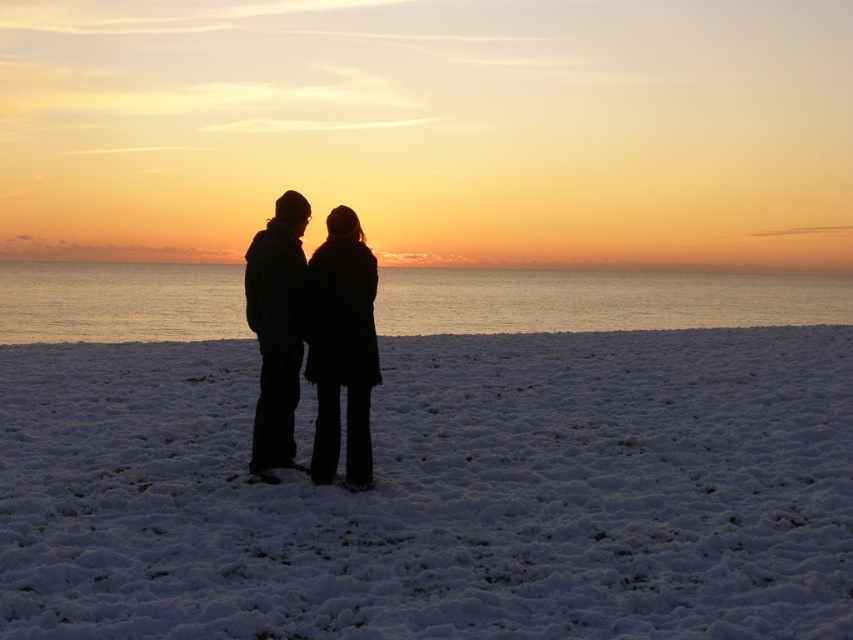
You are a photographer trying to capture both the black fuzzy coat at center and the black matte coat at center in your shot. Which coat should you focus on first if you want to ensure both are in frame without moving the camera?

The black fuzzy coat at center is larger in size compared to the black matte coat at center, so focusing on the larger one first will help ensure both fit within the frame.